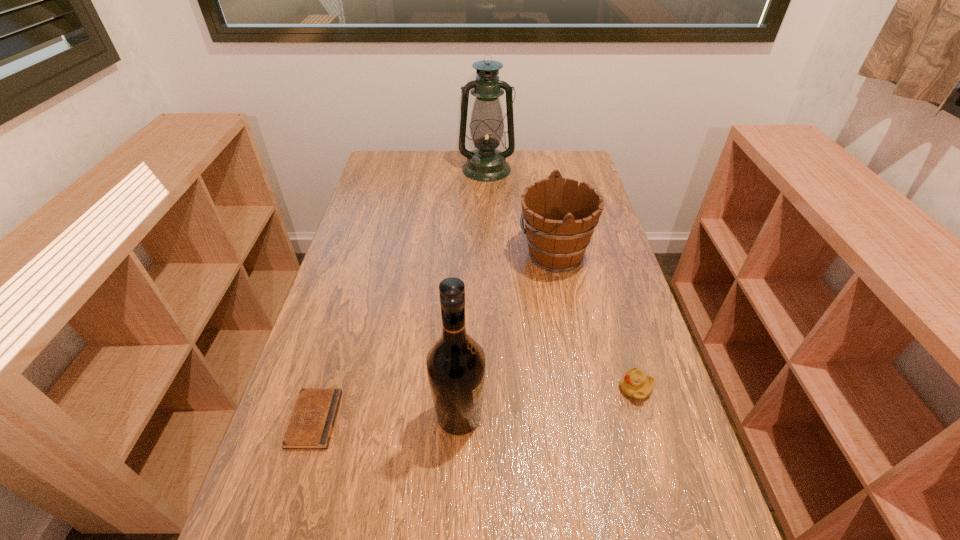
Where is `the farthest object`? the farthest object is located at coordinates (486, 163).

The height and width of the screenshot is (540, 960). In order to click on wine bottle in this screenshot , I will do `click(456, 368)`.

The width and height of the screenshot is (960, 540). Find the location of `the third tallest object`. the third tallest object is located at coordinates (560, 217).

You are a GUI agent. You are given a task and a screenshot of the screen. Output one action in this format:
    pyautogui.click(x=<x>, y=<y>)
    Task: Click on the second farthest object
    Image resolution: width=960 pixels, height=540 pixels.
    Given the screenshot: What is the action you would take?
    pyautogui.click(x=560, y=217)

This screenshot has width=960, height=540. In order to click on duckling in this screenshot , I will do coord(635,384).

Locate an element on the screen. This screenshot has width=960, height=540. the shortest object is located at coordinates (311, 424).

Find the location of `diary`. diary is located at coordinates point(311,424).

Find the location of `vacant area located 0.140m on the left of the oil lamp`. vacant area located 0.140m on the left of the oil lamp is located at coordinates tap(423, 169).

In order to click on free space located on the label of the wine bottle in this screenshot , I will do `click(653, 416)`.

The width and height of the screenshot is (960, 540). Find the location of `free location located 0.220m with the handle on the third tallest object`. free location located 0.220m with the handle on the third tallest object is located at coordinates (444, 253).